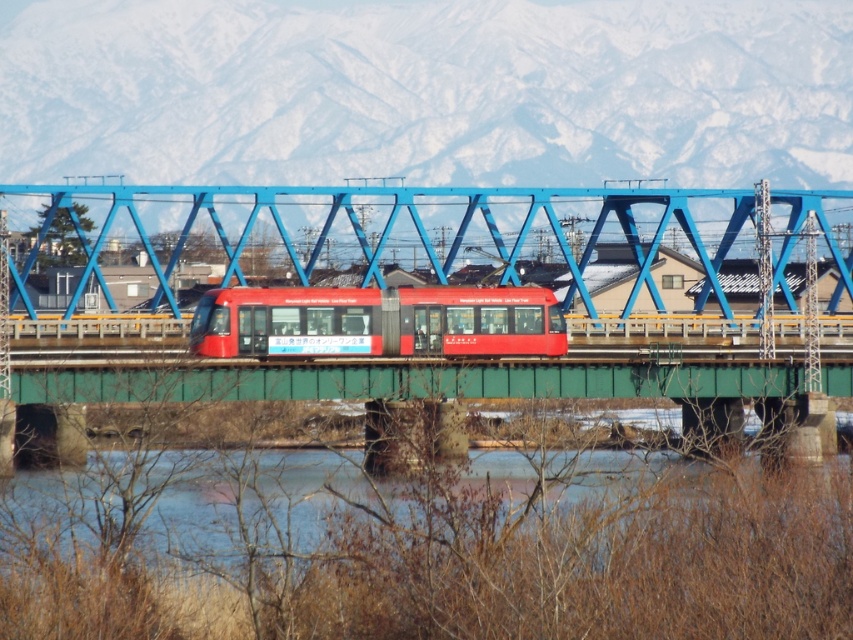
Can you confirm if blue metallic bridge at center is positioned to the left of matte red train at center?

Incorrect, blue metallic bridge at center is not on the left side of matte red train at center.

Is blue metallic bridge at center further to camera compared to matte red train at center?

That is True.

Identify the location of blue metallic bridge at center. (408, 248).

You are a GUI agent. You are given a task and a screenshot of the screen. Output one action in this format:
    pyautogui.click(x=<x>, y=<y>)
    Task: Click on the blue metallic bridge at center
    This screenshot has width=853, height=640.
    Given the screenshot: What is the action you would take?
    pyautogui.click(x=408, y=248)

Measure the distance from translucent ice at lower center to blue metallic bridge at center.

translucent ice at lower center is 113.79 feet away from blue metallic bridge at center.

Looking at this image, does translucent ice at lower center come in front of blue metallic bridge at center?

Yes, it is.

Which is in front, point (251, 536) or point (786, 243)?

Point (251, 536) is more forward.

Where is `translucent ice at lower center`? The image size is (853, 640). translucent ice at lower center is located at coordinates (413, 504).

Between translucent ice at lower center and matte red train at center, which one appears on the left side from the viewer's perspective?

matte red train at center

Who is more forward, (194,490) or (433,336)?

Point (194,490) is more forward.

Image resolution: width=853 pixels, height=640 pixels. I want to click on translucent ice at lower center, so click(413, 504).